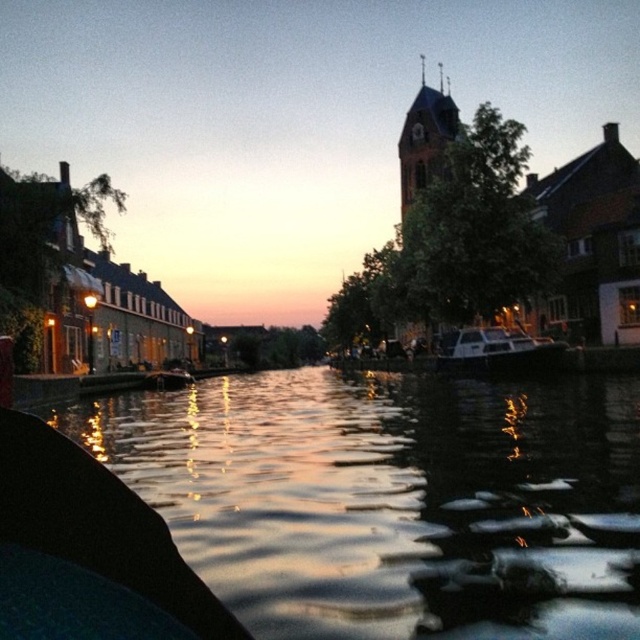
Question: Estimate the real-world distances between objects in this image. Which object is closer to the silvery reflective water at center?

Choices:
 (A) white matte boat at center
 (B) wooden boat at center

Answer: (A)

Question: Which point is farther to the camera?

Choices:
 (A) wooden boat at center
 (B) white matte boat at center

Answer: (A)

Question: Does silvery reflective water at center have a larger size compared to wooden boat at center?

Choices:
 (A) no
 (B) yes

Answer: (B)

Question: In this image, where is white matte boat at center located relative to wooden boat at center?

Choices:
 (A) left
 (B) right

Answer: (B)

Question: Is silvery reflective water at center in front of white matte boat at center?

Choices:
 (A) yes
 (B) no

Answer: (A)

Question: Which is farther from the wooden boat at center?

Choices:
 (A) silvery reflective water at center
 (B) white matte boat at center

Answer: (B)